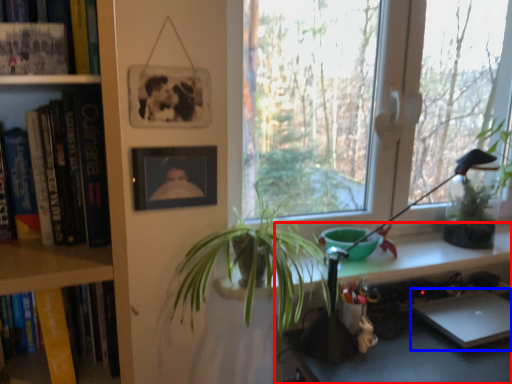
Question: Among these objects, which one is nearest to the camera, desk (highlighted by a red box) or laptop (highlighted by a blue box)?

Choices:
 (A) desk
 (B) laptop

Answer: (A)